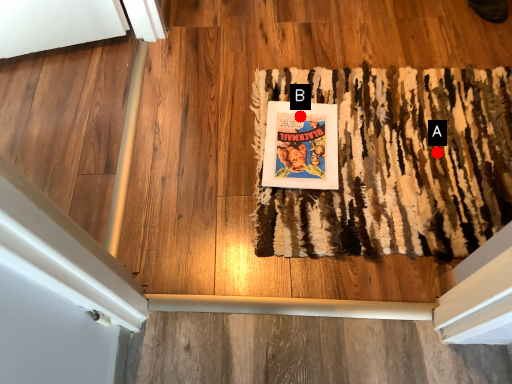
Question: Two points are circled on the image, labeled by A and B beside each circle. Among these points, which one is nearest to the camera?

Choices:
 (A) A is closer
 (B) B is closer

Answer: (A)